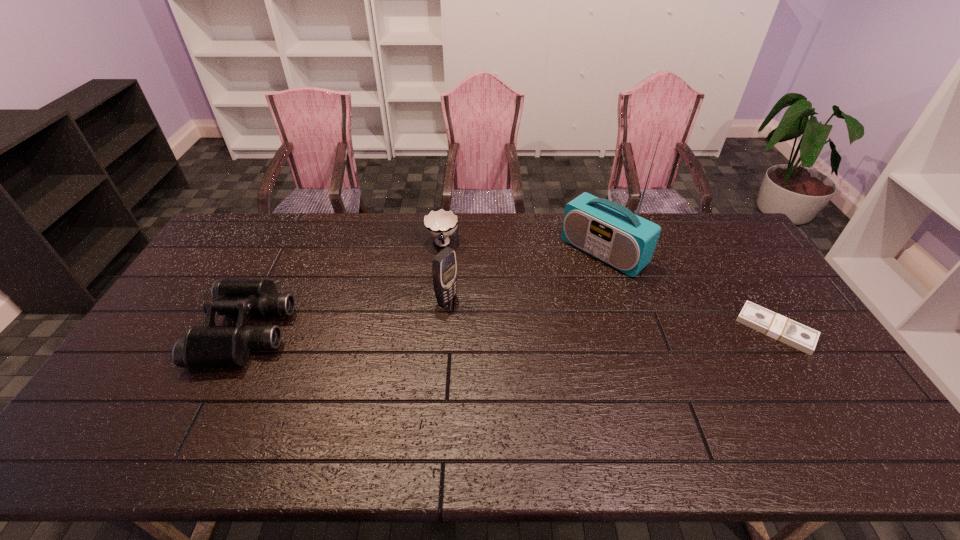
Find the location of a particular element. The height and width of the screenshot is (540, 960). free spot on the desktop that is between the leftmost object and the shortest object and is positioned on the front panel of the second object from right to left is located at coordinates 510,329.

Image resolution: width=960 pixels, height=540 pixels. I want to click on vacant spot on the desktop that is between the binoculars and the rightmost object and is positioned on the front face of the second tallest object, so click(x=504, y=329).

This screenshot has height=540, width=960. In order to click on vacant space on the desktop that is between the third shortest object and the shortest object and is positioned on the side of the cup with the handle in this screenshot , I will do `click(454, 329)`.